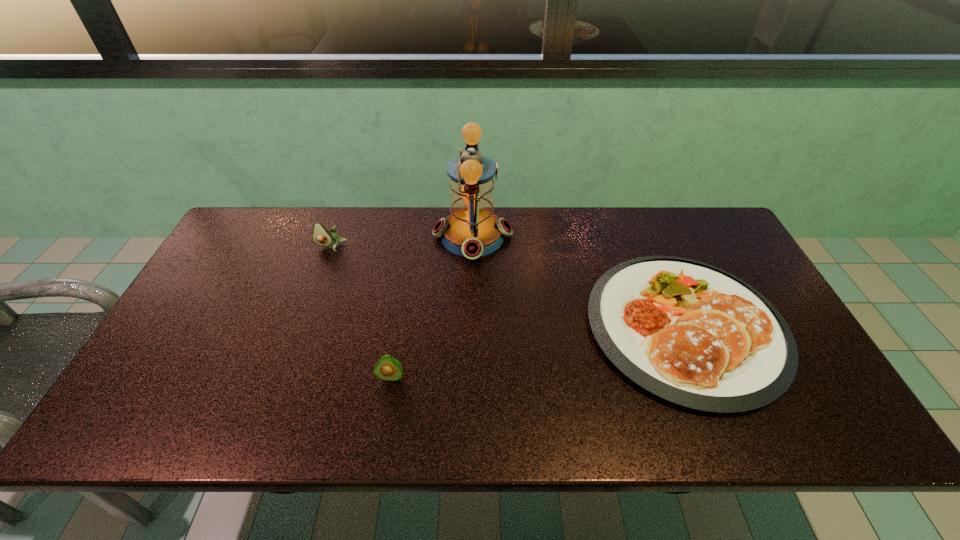
This screenshot has width=960, height=540. Identify the location of free location that satisfies the following two spatial constraints: 1. on the front-facing side of the rightmost object; 2. on the right side of the tallest object. (470, 327).

The width and height of the screenshot is (960, 540). In order to click on free location that satisfies the following two spatial constraints: 1. on the seed side of the dish; 2. on the right side of the leftmost object in this screenshot , I will do `click(301, 327)`.